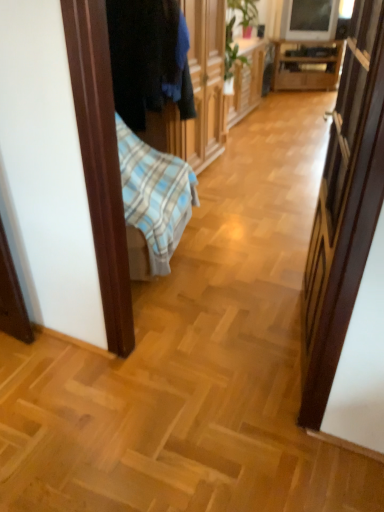
Question: Considering the positions of point (276, 64) and point (240, 100), is point (276, 64) closer or farther from the camera than point (240, 100)?

Choices:
 (A) closer
 (B) farther

Answer: (B)

Question: Which is correct: wooden cabinet at center is inside wooden cabinet at center, or outside of it?

Choices:
 (A) outside
 (B) inside

Answer: (A)

Question: Estimate the real-world distances between objects in this image. Which object is closer to the wooden cabinet at center?

Choices:
 (A) wooden cabinet at center
 (B) dark blue fabric at left

Answer: (A)

Question: Considering the real-world distances, which object is closest to the wooden cabinet at center?

Choices:
 (A) dark blue fabric at left
 (B) wooden cabinet at center

Answer: (B)